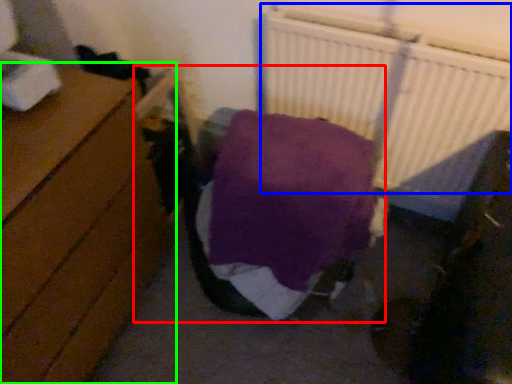
Question: Which is nearer to the bed (highlighted by a red box)? radiator (highlighted by a blue box) or furniture (highlighted by a green box).

Choices:
 (A) radiator
 (B) furniture

Answer: (B)